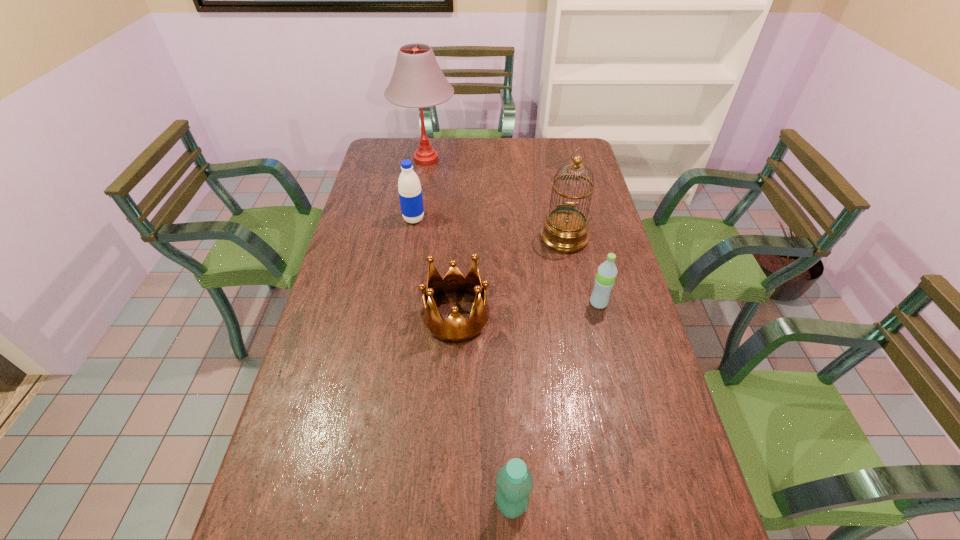
This screenshot has height=540, width=960. What are the coordinates of `vacant space at the left edge of the desktop` in the screenshot? It's located at 336,423.

This screenshot has width=960, height=540. Find the location of `vacant space at the right edge of the desktop`. vacant space at the right edge of the desktop is located at coordinates tap(601, 244).

At what (x,y) coordinates should I click in order to perform the action: click on free space between the fifth shortest object and the farthest object. Please return your answer as a coordinate pair (x, y). Looking at the image, I should click on [x=495, y=198].

I want to click on free space that is in between the rightmost water bottle and the crown, so 527,309.

This screenshot has height=540, width=960. Identify the location of free space between the fourth object from left to right and the crown. (484, 410).

The height and width of the screenshot is (540, 960). Find the location of `free spot between the farthest object and the crown`. free spot between the farthest object and the crown is located at coordinates (441, 238).

Locate an element on the screen. This screenshot has height=540, width=960. free point between the leftmost water bottle and the birdcage is located at coordinates (489, 228).

This screenshot has height=540, width=960. Find the location of `free area in between the rightmost water bottle and the fourth object from left to right`. free area in between the rightmost water bottle and the fourth object from left to right is located at coordinates (555, 403).

Where is `free space between the second farthest water bottle and the farthest water bottle`? The image size is (960, 540). free space between the second farthest water bottle and the farthest water bottle is located at coordinates (506, 261).

At what (x,y) coordinates should I click in order to perform the action: click on free point between the crown and the farthest object. Please return your answer as a coordinate pair (x, y). Image resolution: width=960 pixels, height=540 pixels. Looking at the image, I should click on (441, 238).